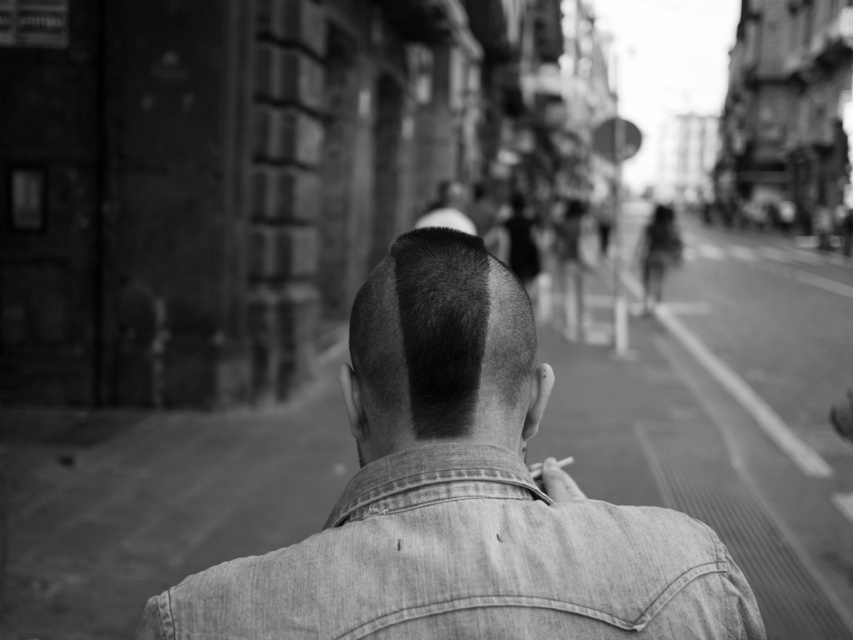
You are a fashion designer observing the person in the image. You need to determine if the denim jacket at center can be seen from above the short hair at center. Based on the scene description, what is your conclusion?

The denim jacket at center is positioned under short hair at center, so the denim jacket at center cannot be seen from above the short hair at center.

You are a photographer trying to capture the short hair at center and the faded denim jacket at lower right in focus. Since you can only focus on one object at a time, which one should you choose to ensure it appears sharp in the photo?

The faded denim jacket at lower right is closer to the viewer than the short hair at center, so focusing on it will keep it sharp while the short hair at center may appear slightly blurred. If you focus on the short hair at center, both might be acceptably sharp due to depth of field, but prioritizing the closer object ensures clarity.

You are a photographer analyzing the composition of this black and white photo. The subject is wearing a faded denim jacket at lower right. To ensure the jacket is in the frame when cropping the image, what coordinates should you focus on?

The faded denim jacket at lower right is located at coordinates point (x=469, y=564), so you should focus on those coordinates to keep it in the frame.